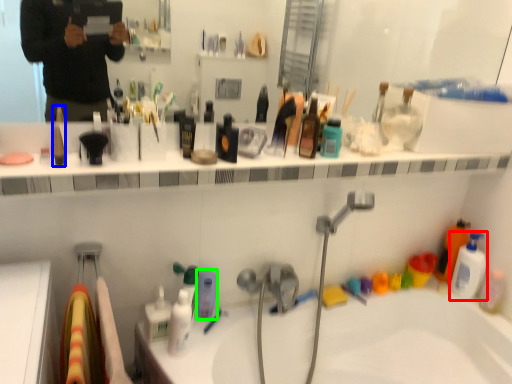
Question: Considering the real-world distances, which object is farthest from mouthwash (highlighted by a red box)? toiletry (highlighted by a blue box) or toiletry (highlighted by a green box)?

Choices:
 (A) toiletry
 (B) toiletry

Answer: (A)